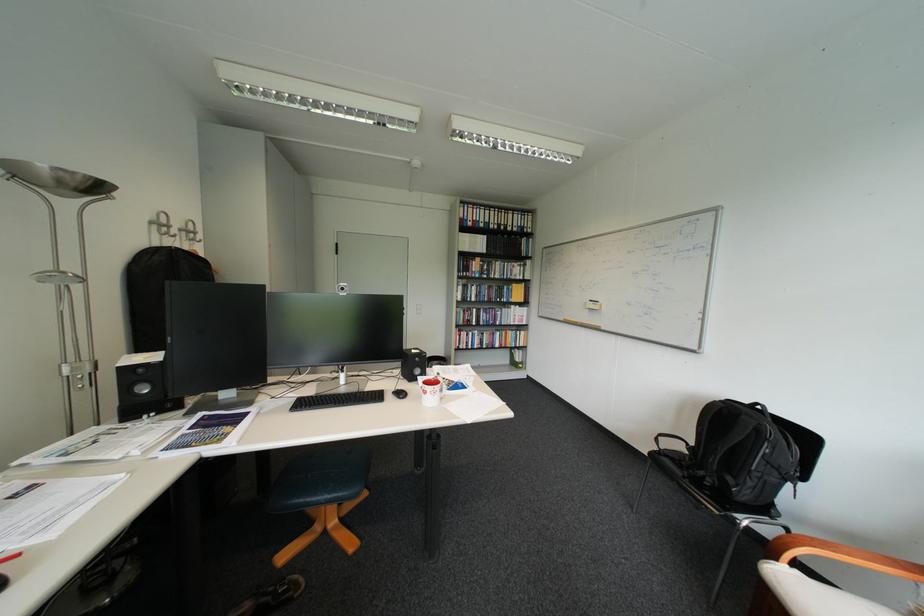
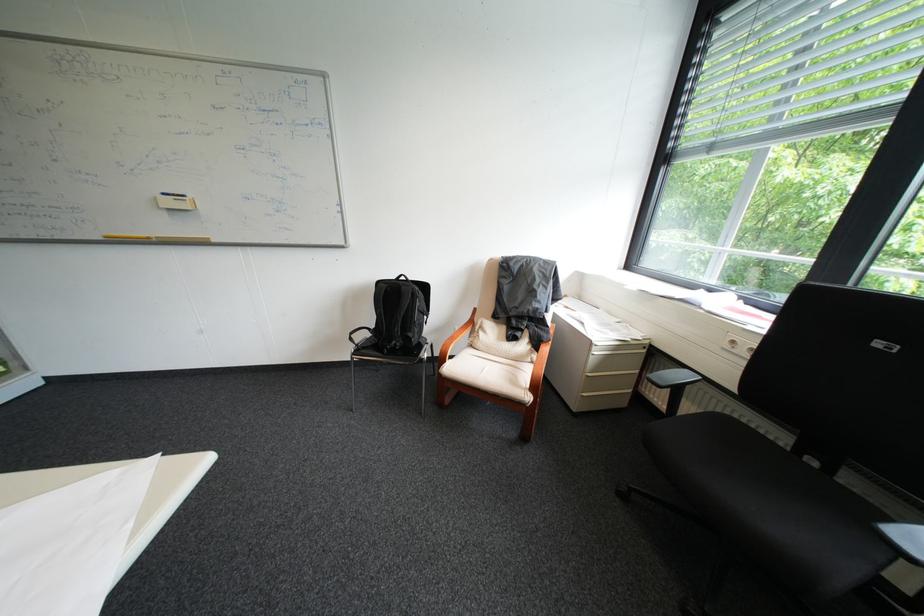
Locate, in the second image, the point that corresponds to [752,524] in the first image.

(436, 358)